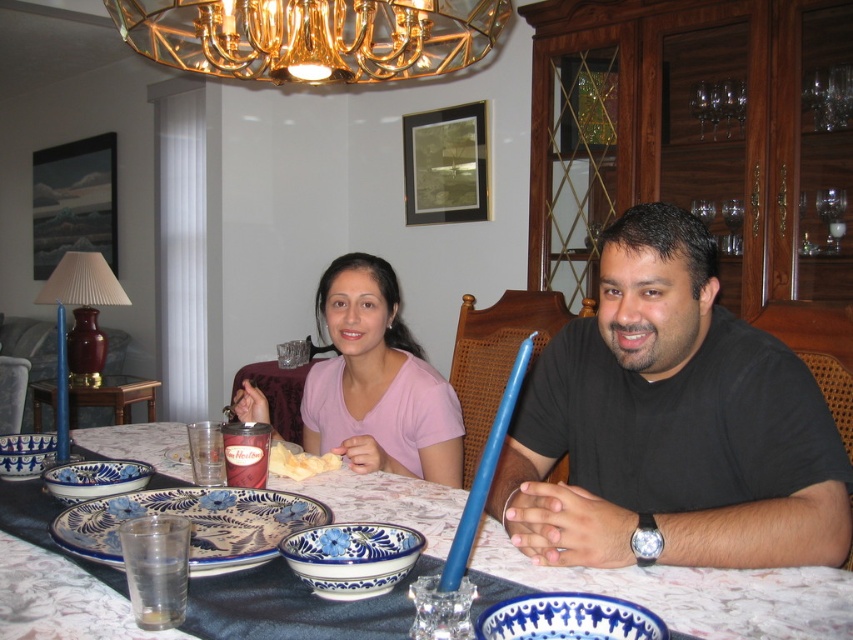
Question: Which of the following is the farthest from the observer?

Choices:
 (A) (71, 573)
 (B) (514, 628)
 (C) (341, 355)
 (D) (294, 449)

Answer: (C)

Question: Which object is the farthest from the blue ceramic plate at lower center?

Choices:
 (A) wooden table at center
 (B) pink matte shirt at center

Answer: (A)

Question: Considering the relative positions of black matte shirt at center and blue ceramic plate at center in the image provided, where is black matte shirt at center located with respect to blue ceramic plate at center?

Choices:
 (A) left
 (B) right

Answer: (B)

Question: Observing the image, what is the correct spatial positioning of black matte shirt at center in reference to wooden table at center?

Choices:
 (A) left
 (B) right

Answer: (B)

Question: Does pink matte shirt at center appear under blue ceramic plate at center?

Choices:
 (A) no
 (B) yes

Answer: (A)

Question: Considering the real-world distances, which object is farthest from the white crumbly cake at center?

Choices:
 (A) clear glass water at lower left
 (B) pink matte shirt at center
 (C) gold metallic chandelier at upper center

Answer: (C)